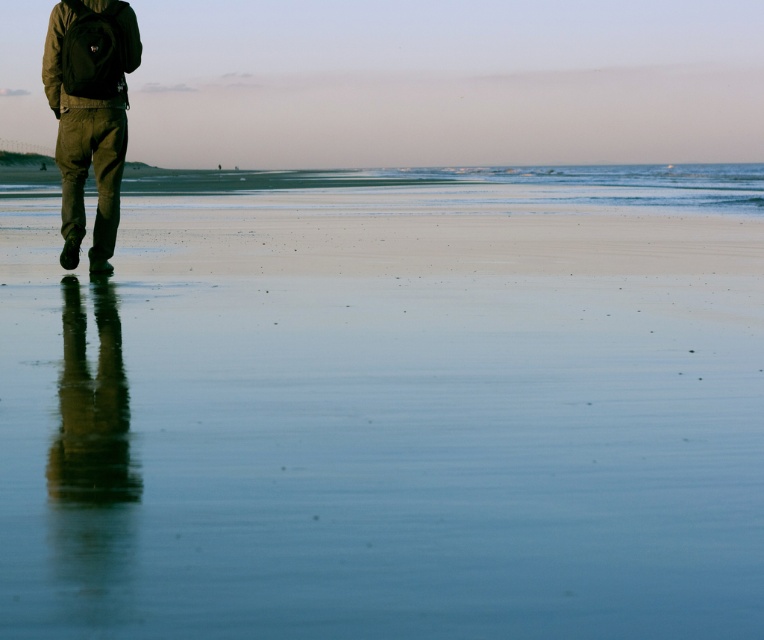
You are standing on the beach and see the smooth sand at lower left and the olive green corduroy pants at left. Which object takes up more space in the image?

The smooth sand at lower left takes up more space in the image because it is bigger than the olive green corduroy pants at left.

You are standing at the point marked as point (x=387, y=404) and want to walk towards the smooth sand at lower left. Is the direction towards the smooth sand at lower left towards the beach or the sea?

The smooth sand at lower left is located at point (x=387, y=404), so walking towards it would be heading towards the beach.

You are standing at the point closer to the horizon in the beach scene. Which point are you at, point (117, 548) or point (102, 241)?

Point (117, 548) is in front of point (102, 241), so you are at point (117, 548).